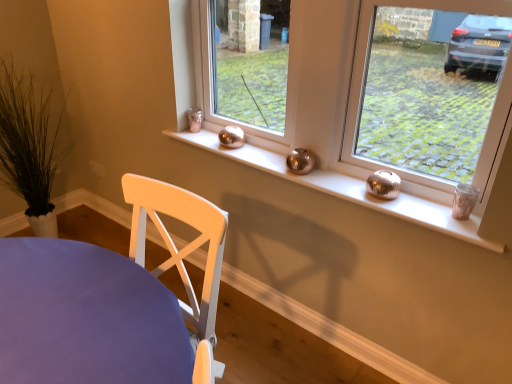
Question: Is the surface of shiny metallic candle holder at right in direct contact with white painted wood chair at lower left?

Choices:
 (A) yes
 (B) no

Answer: (B)

Question: Is the position of shiny metallic candle holder at right more distant than that of white painted wood chair at lower left?

Choices:
 (A) yes
 (B) no

Answer: (A)

Question: From a real-world perspective, does shiny metallic candle holder at right sit lower than white painted wood chair at lower left?

Choices:
 (A) no
 (B) yes

Answer: (A)

Question: Does shiny metallic candle holder at right appear on the right side of white painted wood chair at lower left?

Choices:
 (A) no
 (B) yes

Answer: (B)

Question: Does shiny metallic candle holder at right have a larger size compared to white painted wood chair at lower left?

Choices:
 (A) no
 (B) yes

Answer: (A)

Question: From the image's perspective, relative to shiny metallic candle holder at right, is metallic silver vases at center, the second window when ordered from right to left, above or below?

Choices:
 (A) below
 (B) above

Answer: (B)

Question: Is metallic silver vases at center, which is counted as the 2th window, starting from the left, spatially inside shiny metallic candle holder at right, or outside of it?

Choices:
 (A) inside
 (B) outside

Answer: (B)

Question: Considering the relative positions of metallic silver vases at center, which is counted as the 2th window, starting from the left, and shiny metallic candle holder at right in the image provided, is metallic silver vases at center, which is counted as the 2th window, starting from the left, to the left or to the right of shiny metallic candle holder at right?

Choices:
 (A) right
 (B) left

Answer: (B)

Question: Considering their positions, is metallic silver vases at center, which is counted as the 2th window, starting from the left, located in front of or behind shiny metallic candle holder at right?

Choices:
 (A) front
 (B) behind

Answer: (A)

Question: Is point (392, 193) closer or farther from the camera than point (495, 69)?

Choices:
 (A) closer
 (B) farther

Answer: (A)

Question: Is shiny metallic candle holder at right wider or thinner than metallic silver candle holder at right, the 3th window from the left?

Choices:
 (A) thin
 (B) wide

Answer: (B)

Question: From a real-world perspective, is shiny metallic candle holder at right positioned above or below metallic silver candle holder at right, the 3th window from the left?

Choices:
 (A) below
 (B) above

Answer: (A)

Question: From the image's perspective, is shiny metallic candle holder at right located above or below metallic silver candle holder at right, arranged as the first window when viewed from the right?

Choices:
 (A) above
 (B) below

Answer: (B)

Question: Considering the positions of metallic silver vases at center, which is counted as the 2th window, starting from the left, and white painted wood chair at lower left in the image, is metallic silver vases at center, which is counted as the 2th window, starting from the left, wider or thinner than white painted wood chair at lower left?

Choices:
 (A) thin
 (B) wide

Answer: (A)

Question: Looking at the image, does metallic silver vases at center, the second window when ordered from right to left, seem bigger or smaller compared to white painted wood chair at lower left?

Choices:
 (A) small
 (B) big

Answer: (A)